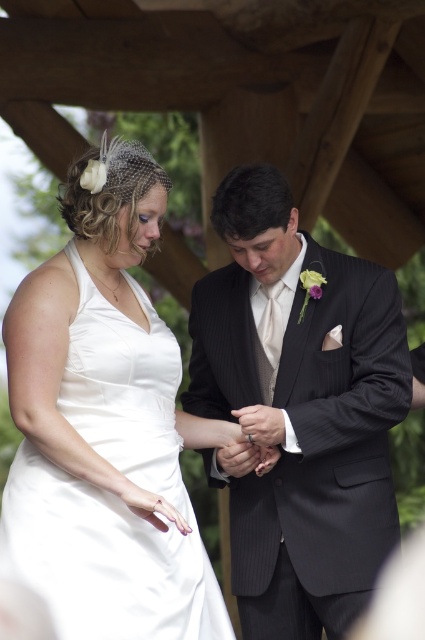
In the scene shown: Is black pinstripe suit at center further to camera compared to silver metallic ring at center?

That is False.

Can you confirm if black pinstripe suit at center is positioned to the left of silver metallic ring at center?

Incorrect, black pinstripe suit at center is not on the left side of silver metallic ring at center.

Which is in front, point (334, 477) or point (249, 436)?

Point (249, 436) is more forward.

Find the location of a particular element. This screenshot has width=425, height=640. black pinstripe suit at center is located at coordinates (299, 412).

Between point (360, 317) and point (189, 563), which one is positioned behind?

The point (360, 317) is more distant.

Does point (342, 490) come farther from viewer compared to point (11, 531)?

Yes.

This screenshot has width=425, height=640. I want to click on black pinstripe suit at center, so click(299, 412).

Locate an element on the screen. The image size is (425, 640). black pinstripe suit at center is located at coordinates (299, 412).

In the scene shown: Does satin white dress at center appear over silver metallic ring at center?

Yes.

Is point (122, 380) farther from viewer compared to point (249, 440)?

No, (122, 380) is closer to viewer.

Between point (113, 600) and point (251, 444), which one is positioned in front?

Point (113, 600)

You are a GUI agent. You are given a task and a screenshot of the screen. Output one action in this format:
    pyautogui.click(x=<x>, y=<y>)
    Task: Click on the satin white dress at center
    The height and width of the screenshot is (640, 425).
    Given the screenshot: What is the action you would take?
    pyautogui.click(x=113, y=493)